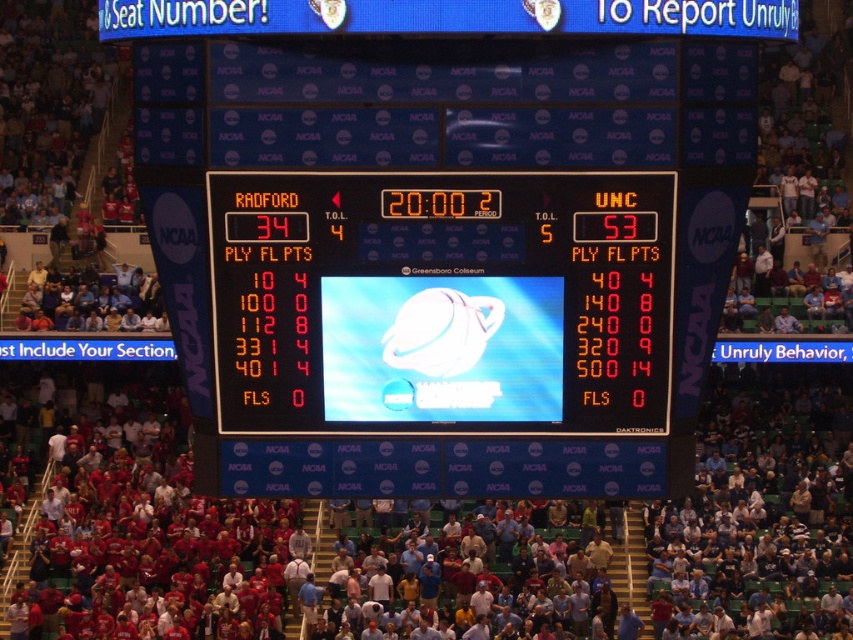
Does point (527, 417) lie behind point (375, 349)?

Yes, point (527, 417) is farther from viewer.

Is point (503, 348) closer to viewer compared to point (554, 358)?

No.

Who is more distant from viewer, (323,340) or (369,344)?

Point (369,344)

This screenshot has width=853, height=640. Identify the location of orange digital scoreboard at center. (440, 301).